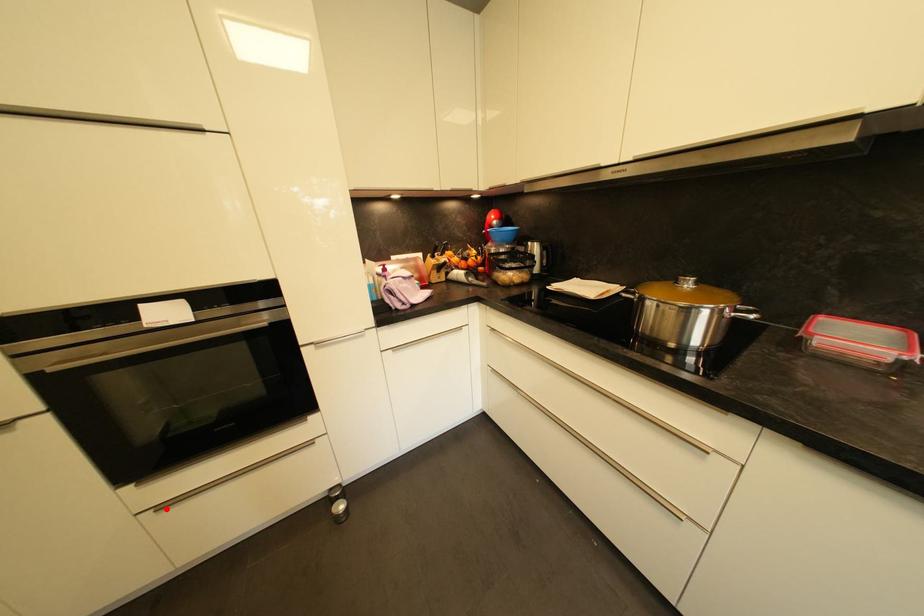
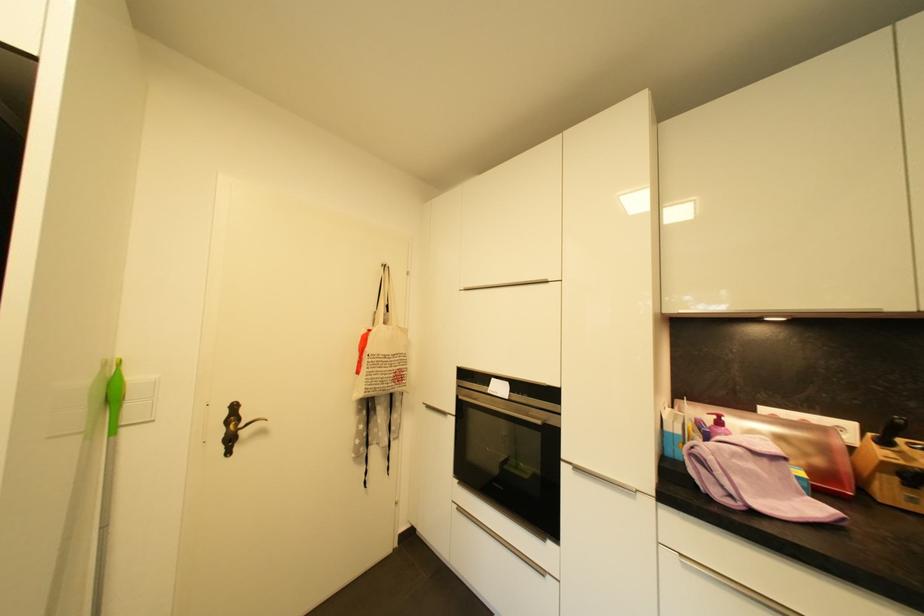
Locate, in the second image, the point that corresponds to the highlighted location in the first image.

(465, 511)